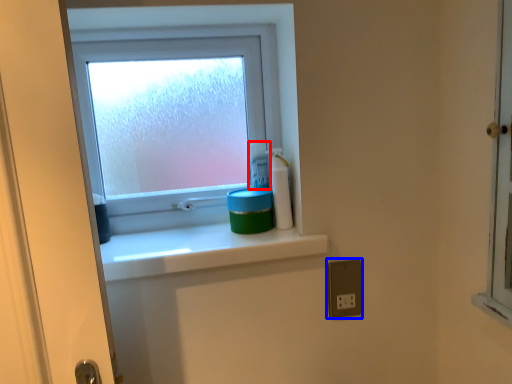
Question: Among these objects, which one is farthest to the camera, toiletry (highlighted by a red box) or electric outlet (highlighted by a blue box)?

Choices:
 (A) toiletry
 (B) electric outlet

Answer: (A)